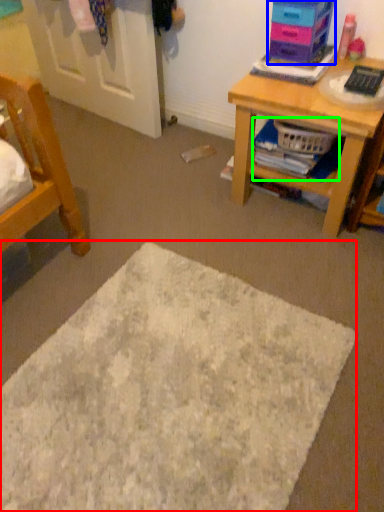
Question: Based on their relative distances, which object is farther from mat (highlighted by a red box)? Choose from shelf (highlighted by a blue box) and book (highlighted by a green box).

Choices:
 (A) shelf
 (B) book

Answer: (A)